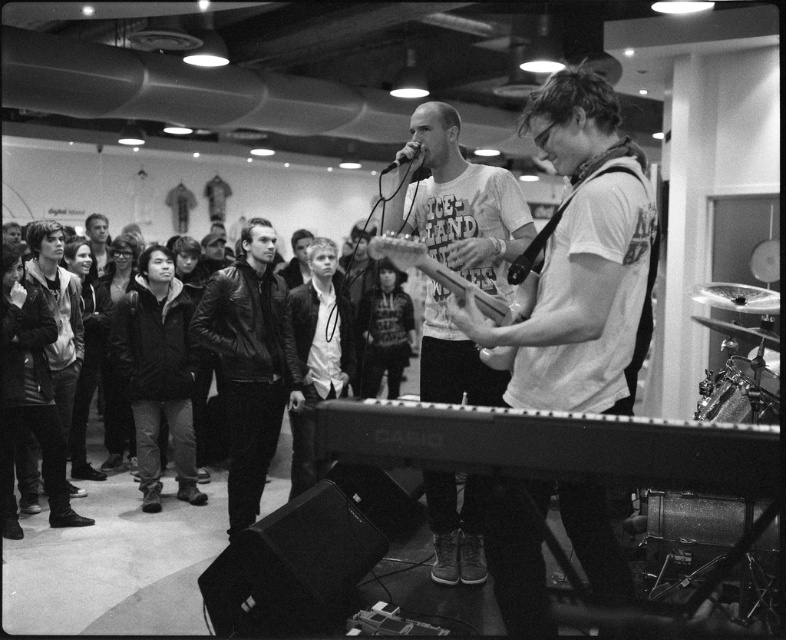
You are a photographer at the event and want to capture a closeup shot of the metallic silver guitar at center without the smooth leather jacket at left appearing in the frame. Is this possible given their sizes?

The metallic silver guitar at center is smaller than the smooth leather jacket at left. Since the guitar is smaller, it might be challenging to frame it without including the jacket unless you adjust your angle or zoom in closely.

You are standing at the origin point in the coordinate system of the image. The metallic silver keyboard at lower center is located at coordinates approximately 0.697 on the x axis and 0.704 on the y axis. If you want to move directly towards the keyboard, which direction should you move in terms of the coordinate system?

To move directly towards the metallic silver keyboard at lower center located at coordinates approximately 0.697 on the x axis and 0.704 on the y axis, you should move in the positive x and positive y direction since the keyboard is at higher x and y coordinates compared to the origin.